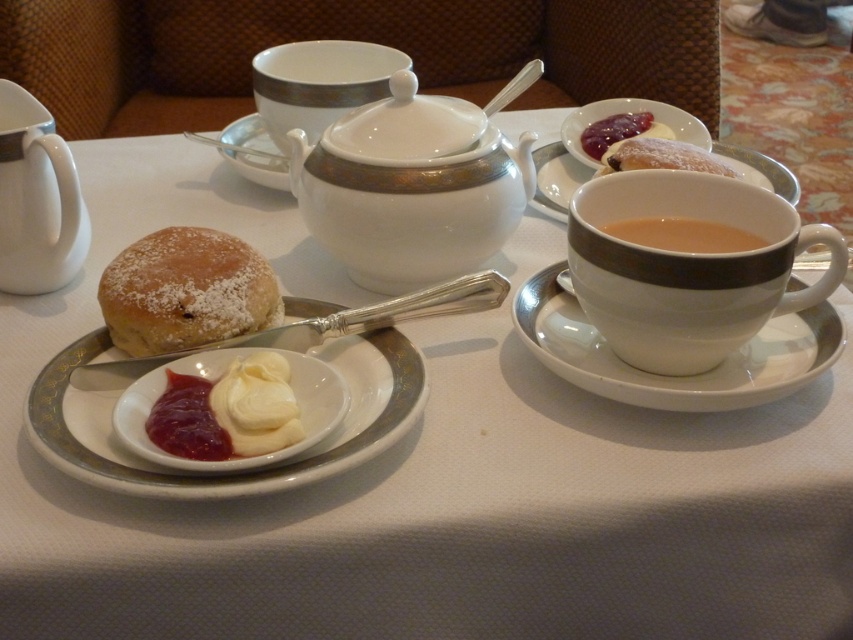
Who is positioned more to the right, brown matte cup at center right or smooth white cream at center?

Positioned to the right is smooth white cream at center.

Which is behind, point (651, 228) or point (669, 132)?

The point (669, 132) is more distant.

This screenshot has height=640, width=853. In order to click on brown matte cup at center right in this screenshot , I will do `click(683, 236)`.

Is point (776, 372) less distant than point (64, 182)?

Yes, it is in front of point (64, 182).

Identify the location of white ceramic saucer at right. Image resolution: width=853 pixels, height=640 pixels. (674, 376).

Who is more distant from viewer, (692, 156) or (235, 132)?

The point (235, 132) is more distant.

Does point (643, 138) lie behind point (231, 157)?

No, (643, 138) is in front of (231, 157).

At what (x,y) coordinates should I click in order to perform the action: click on powdered sugar bun at upper center. Please return your answer as a coordinate pair (x, y). This screenshot has width=853, height=640. Looking at the image, I should click on (660, 156).

Find the location of a particular element. powdered sugar bun at upper center is located at coordinates (660, 156).